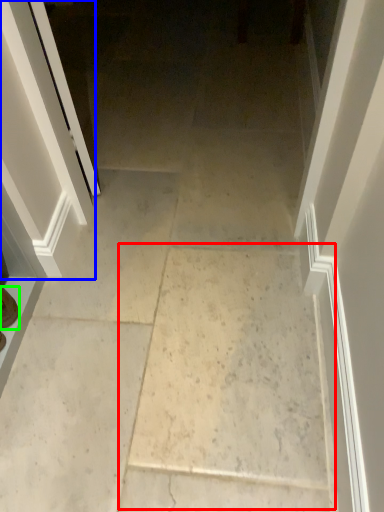
Question: Estimate the real-world distances between objects in this image. Which object is closer to concrete (highlighted by a red box), screen door (highlighted by a blue box) or footwear (highlighted by a green box)?

Choices:
 (A) screen door
 (B) footwear

Answer: (A)